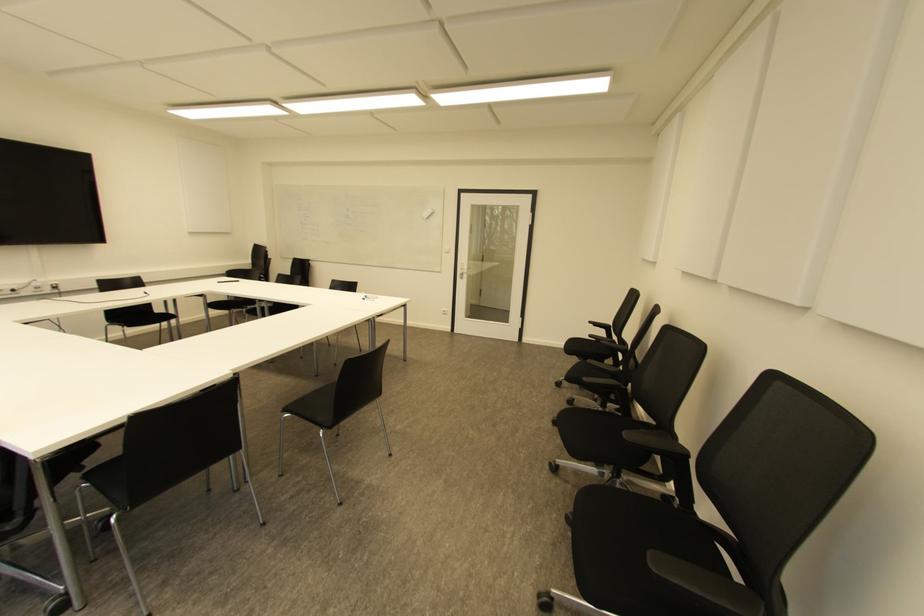
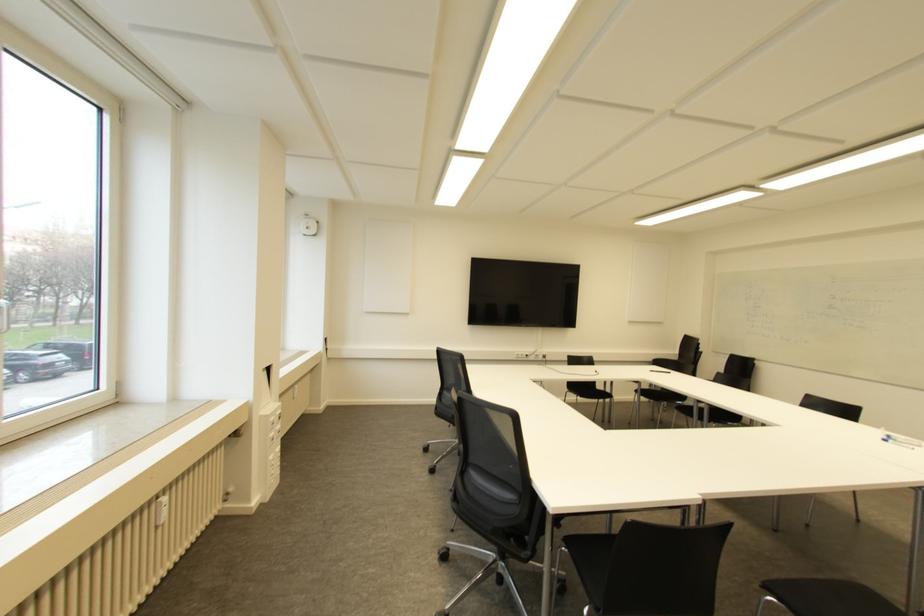
Find the pixel in the second image that matches point 55,286 in the first image.

(543, 355)